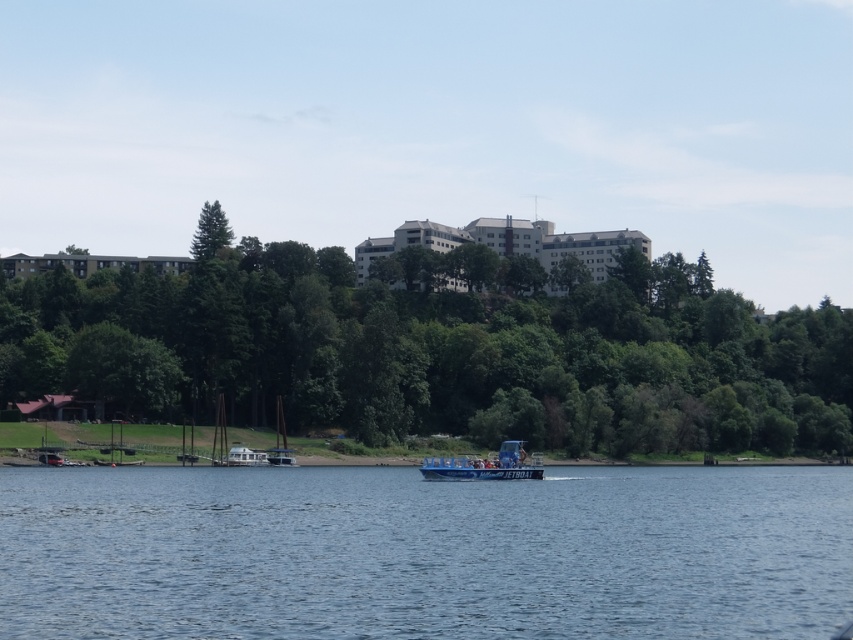
Question: Estimate the real-world distances between objects in this image. Which object is closer to the green matte tree at upper left?

Choices:
 (A) white plastic houseboat at lower center
 (B) blue water at center
 (C) blue plastic boat at center

Answer: (C)

Question: Which point appears farthest from the camera in this image?

Choices:
 (A) (131, 323)
 (B) (225, 218)
 (C) (535, 465)
 (D) (80, 512)

Answer: (B)

Question: Which object appears closest to the camera in this image?

Choices:
 (A) blue plastic boat at center
 (B) green leafy tree at center
 (C) blue water at center
 (D) green matte tree at upper left

Answer: (C)

Question: Is green leafy tree at center closer to the viewer compared to blue plastic boat at center?

Choices:
 (A) yes
 (B) no

Answer: (B)

Question: Where is green leafy tree at center located in relation to green matte tree at upper left in the image?

Choices:
 (A) left
 (B) right

Answer: (B)

Question: Can you confirm if blue water at center is positioned to the left of blue plastic boat at center?

Choices:
 (A) no
 (B) yes

Answer: (A)